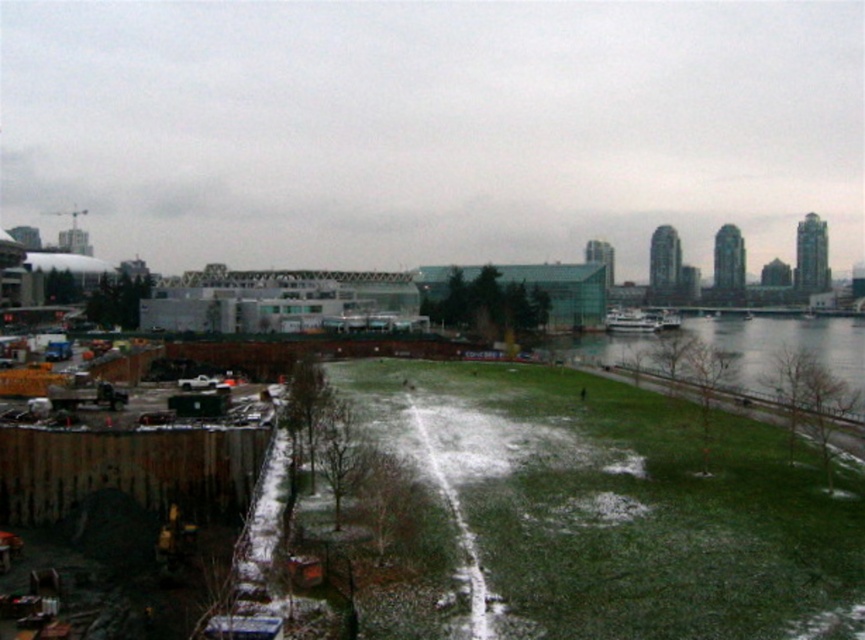
You are a gardener planning to plant new flowers in the urban landscape. You have two patches of green grass at lower center and green grass at lower right. Which patch would be better for planting based on their thickness?

The green grass at lower right is thicker than the green grass at lower center, making it better for planting flowers.

You are a gardener who needs to mow the lawn. You see two patches of green grass at lower center and green grass at lower right. Which patch requires mowing first based on their height?

The green grass at lower right requires mowing first because it is taller than the green grass at lower center.